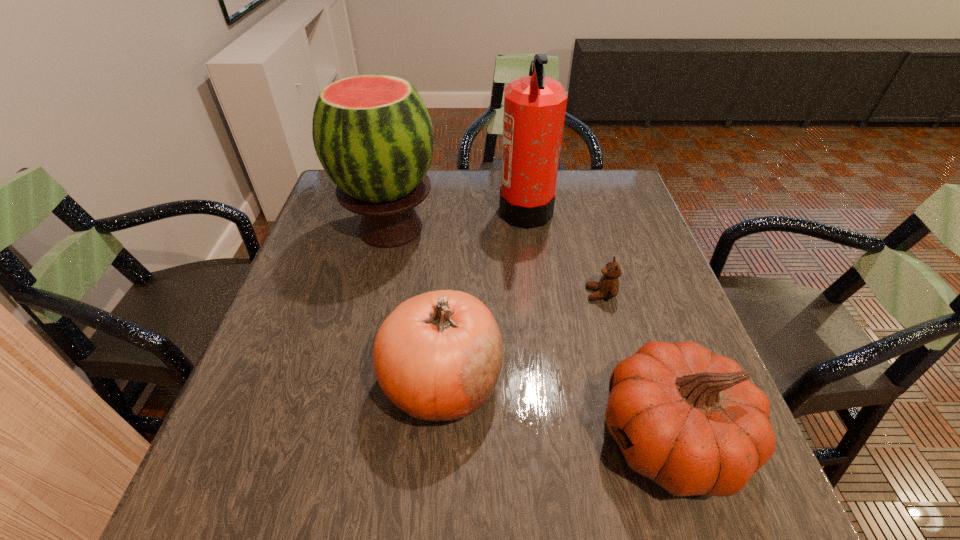
Where is `object identified as the fourth closest to the fire extinguisher`? The width and height of the screenshot is (960, 540). object identified as the fourth closest to the fire extinguisher is located at coordinates (691, 420).

Find the location of a particular element. the third closest object to the third object from right to left is located at coordinates (438, 356).

I want to click on free location that satisfies the following two spatial constraints: 1. at the face of the teddy bear; 2. on the front side of the left pumpkin, so point(624,381).

At what (x,y) coordinates should I click in order to perform the action: click on free location that satisfies the following two spatial constraints: 1. at the face of the third farthest object; 2. on the front side of the left pumpkin. Please return your answer as a coordinate pair (x, y). Looking at the image, I should click on (624, 381).